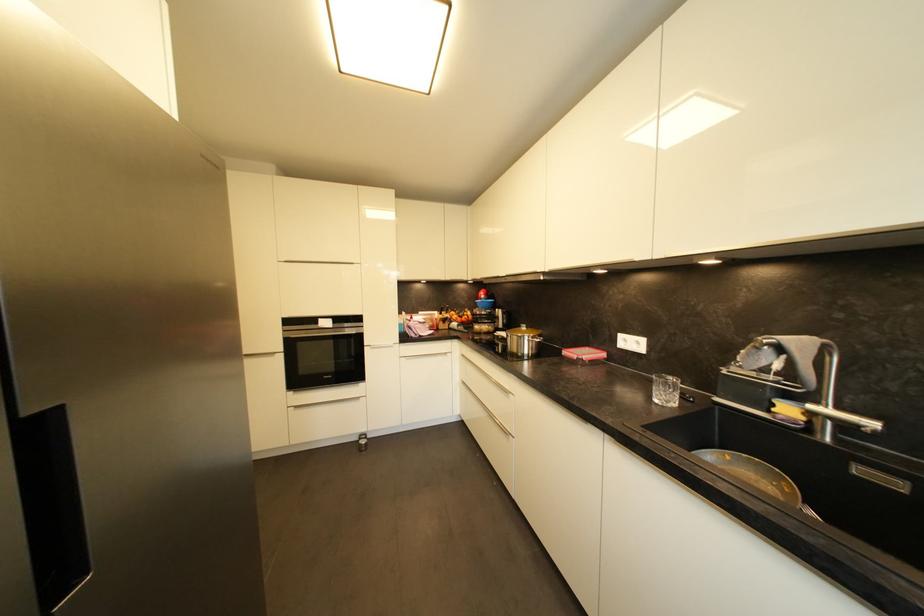
Locate an element on the screen. faucet lever handle is located at coordinates (880, 477).